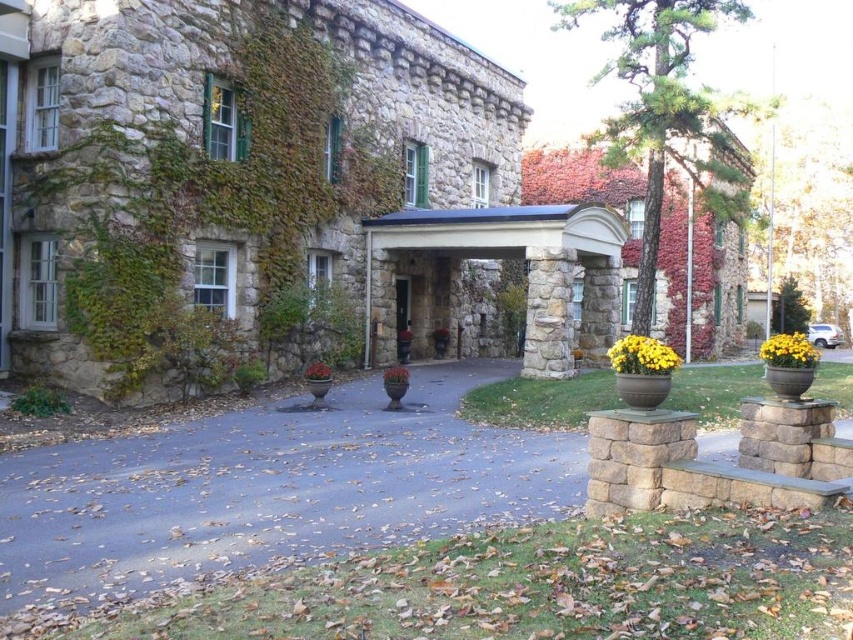
Between yellow matte flower pot at center and yellow matte flower pot at center-right, which one is positioned lower?

yellow matte flower pot at center is below.

Based on the photo, can you confirm if yellow matte flower pot at center is positioned below yellow matte flower pot at center-right?

Correct, yellow matte flower pot at center is located below yellow matte flower pot at center-right.

Does point (635, 372) come closer to viewer compared to point (784, 337)?

Yes, point (635, 372) is closer to viewer.

Locate an element on the screen. yellow matte flower pot at center is located at coordinates (642, 355).

Which is below, yellow matte flower pot at center or green matte planter at center?

Positioned lower is green matte planter at center.

Does yellow matte flower pot at center have a larger size compared to green matte planter at center?

Correct, yellow matte flower pot at center is larger in size than green matte planter at center.

Is point (634, 372) farther from camera compared to point (323, 378)?

No, (634, 372) is in front of (323, 378).

Where is `yellow matte flower pot at center`? yellow matte flower pot at center is located at coordinates (642, 355).

Between green matte planter at center and matte ceramic pot at center, which one appears on the left side from the viewer's perspective?

From the viewer's perspective, green matte planter at center appears more on the left side.

This screenshot has height=640, width=853. I want to click on green matte planter at center, so click(317, 371).

I want to click on green matte planter at center, so click(x=317, y=371).